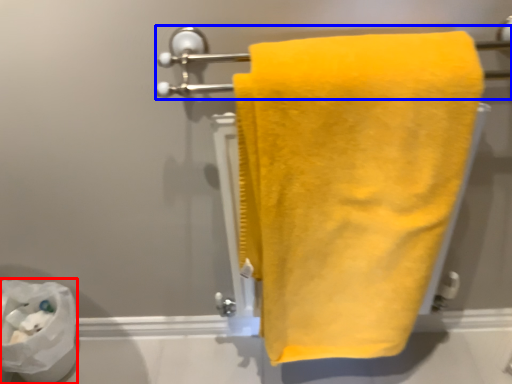
Question: Among these objects, which one is nearest to the camera, toilet paper (highlighted by a red box) or towel bar (highlighted by a blue box)?

Choices:
 (A) toilet paper
 (B) towel bar

Answer: (B)